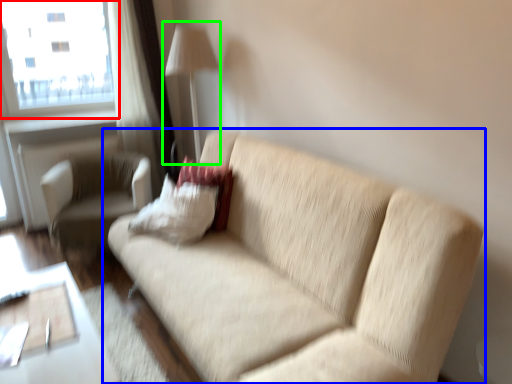
Question: Which object is positioned closest to window (highlighted by a red box)? Select from studio couch (highlighted by a blue box) and table lamp (highlighted by a green box).

Choices:
 (A) studio couch
 (B) table lamp

Answer: (B)